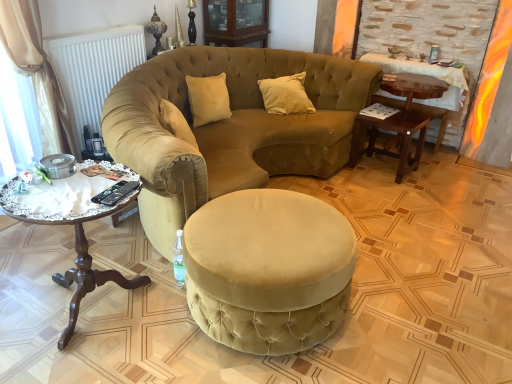
The image size is (512, 384). Find the location of `free spot to the left of woodenwoodencoffee table at left`. free spot to the left of woodenwoodencoffee table at left is located at coordinates (25, 280).